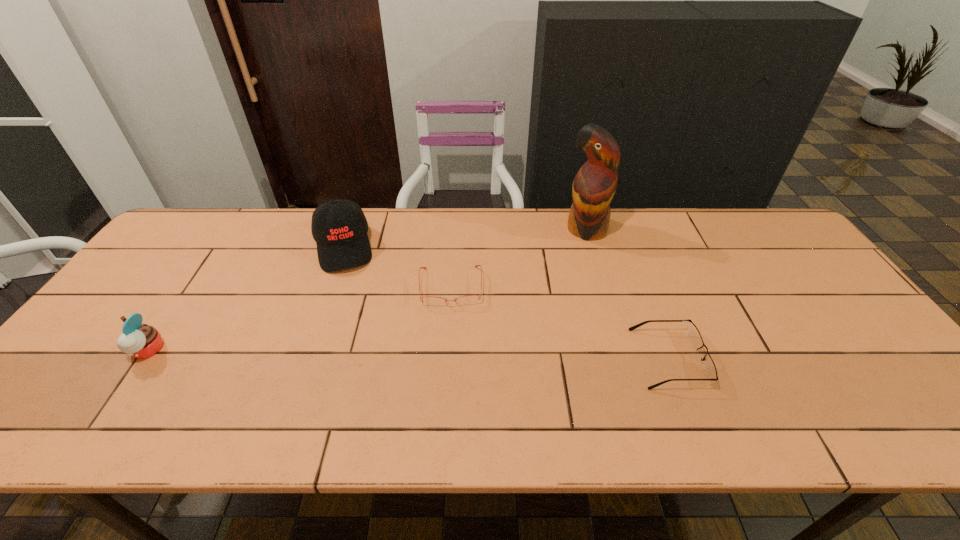
I want to click on parrot at the far edge, so click(594, 185).

You are a GUI agent. You are given a task and a screenshot of the screen. Output one action in this format:
    pyautogui.click(x=<x>, y=<y>)
    Task: Click on the object situated at the near edge
    
    Given the screenshot: What is the action you would take?
    coord(709,367)

The width and height of the screenshot is (960, 540). Identify the location of object at the left edge. (140, 341).

This screenshot has width=960, height=540. Find the location of `vacant space at the far edge`. vacant space at the far edge is located at coordinates (307, 250).

Find the location of a particular element. The width and height of the screenshot is (960, 540). vacant space at the left edge of the desktop is located at coordinates (183, 259).

Locate an element on the screen. Image resolution: width=960 pixels, height=540 pixels. vacant space at the right edge is located at coordinates (815, 304).

At what (x,y) coordinates should I click in order to perform the action: click on free space at the far left corner. Please return your answer as a coordinate pair (x, y). This screenshot has width=960, height=540. Looking at the image, I should click on (210, 232).

In the image, there is a desktop. Identify the location of vacant space at the near left corner. [122, 371].

Image resolution: width=960 pixels, height=540 pixels. In order to click on vacant area at the far right corner of the desktop in this screenshot , I will do `click(772, 221)`.

Locate an element on the screen. Image resolution: width=960 pixels, height=540 pixels. blank space at the near right corner of the desktop is located at coordinates (913, 398).